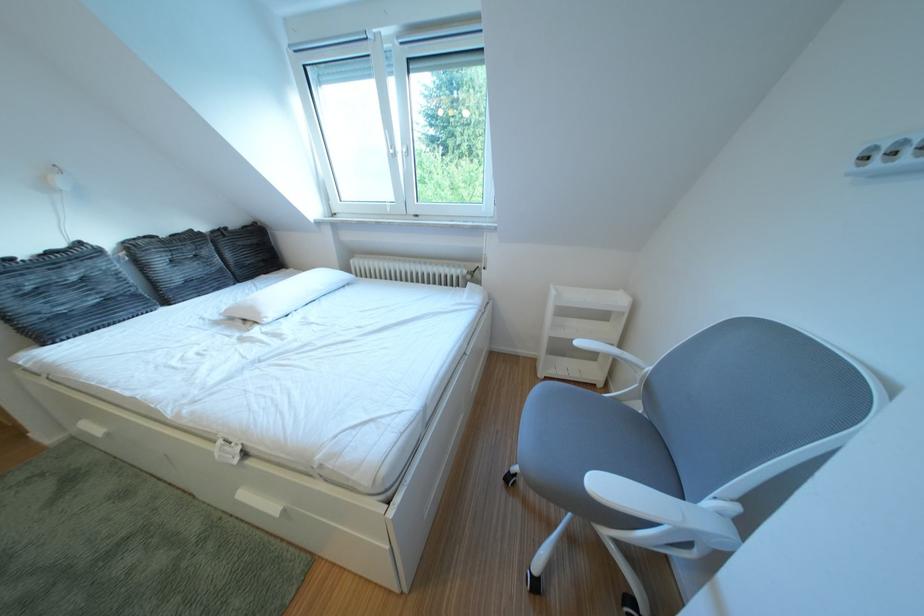
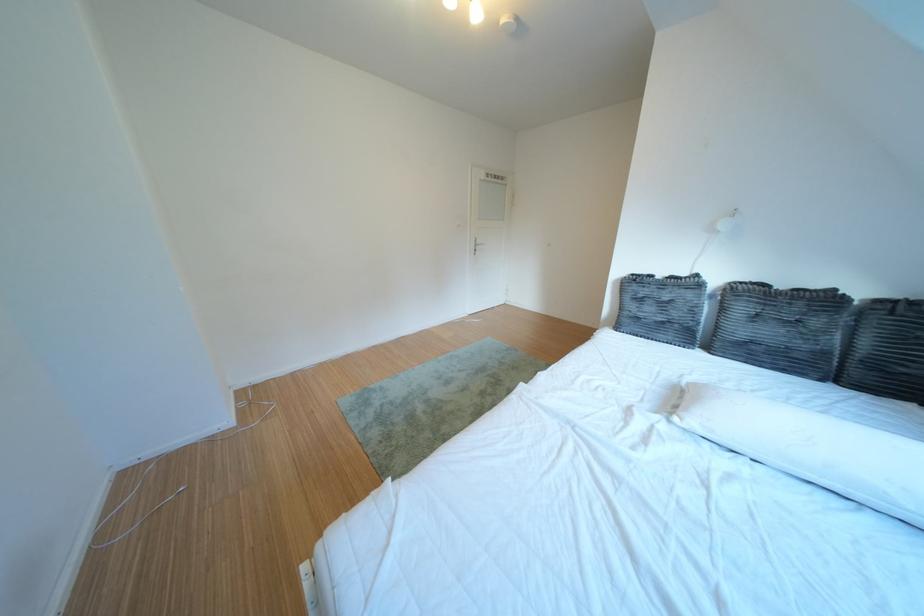
The point at (284, 318) is marked in the first image. Where is the corresponding point in the second image?

(707, 424)